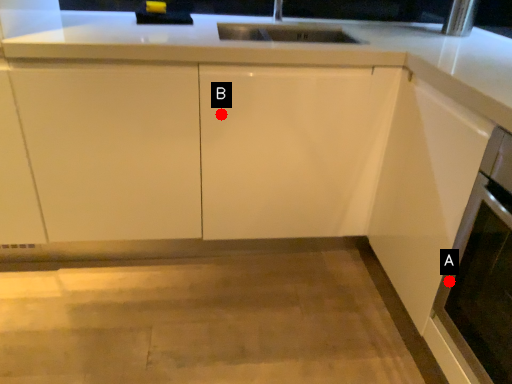
Question: Two points are circled on the image, labeled by A and B beside each circle. Which point appears farthest from the camera in this image?

Choices:
 (A) A is further
 (B) B is further

Answer: (B)